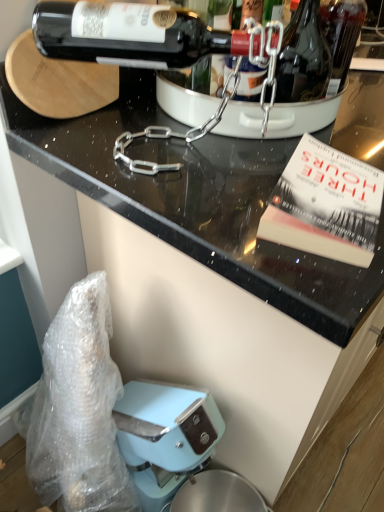
At what (x,y) coordinates should I click in order to perform the action: click on black glossy countertop at upper center. Please return your answer as a coordinate pair (x, y). Image resolution: width=384 pixels, height=512 pixels. Looking at the image, I should click on (199, 202).

From a real-world perspective, which is physically above, hardcover book at upper right or black glossy countertop at upper center?

hardcover book at upper right.

Is hardcover book at upper right bigger than black glossy countertop at upper center?

No, hardcover book at upper right is not bigger than black glossy countertop at upper center.

From the image's perspective, which one is positioned higher, hardcover book at upper right or black glossy countertop at upper center?

black glossy countertop at upper center, from the image's perspective.

Can you tell me how much hardcover book at upper right and black glossy countertop at upper center differ in facing direction?

The angle between the facing direction of hardcover book at upper right and the facing direction of black glossy countertop at upper center is 18.7 degrees.

Does black glossy countertop at upper center appear on the right side of hardcover book at upper right?

Correct, you'll find black glossy countertop at upper center to the right of hardcover book at upper right.

Looking at their sizes, would you say black glossy countertop at upper center is wider or thinner than hardcover book at upper right?

black glossy countertop at upper center is wider than hardcover book at upper right.

How different are the orientations of black glossy countertop at upper center and hardcover book at upper right in degrees?

The angular difference between black glossy countertop at upper center and hardcover book at upper right is 18.7 degrees.

Is shiny dark glass bottle at upper center located within hardcover book at upper right?

That's incorrect, shiny dark glass bottle at upper center is not inside hardcover book at upper right.

Would you say hardcover book at upper right is a long distance from shiny dark glass bottle at upper center?

They are positioned close to each other.

Where is `paperback book that is on the right side of shiny dark glass bottle at upper center`? The image size is (384, 512). paperback book that is on the right side of shiny dark glass bottle at upper center is located at coordinates (325, 205).

From the picture: From their relative heights in the image, would you say hardcover book at upper right is taller or shorter than shiny dark glass bottle at upper center?

In the image, hardcover book at upper right appears to be shorter than shiny dark glass bottle at upper center.

Based on their sizes in the image, would you say shiny dark glass bottle at upper right is bigger or smaller than hardcover book at upper right?

In the image, shiny dark glass bottle at upper right appears to be larger than hardcover book at upper right.

Is shiny dark glass bottle at upper right looking in the opposite direction of hardcover book at upper right?

No.

Is point (289, 52) closer or farther from the camera than point (325, 253)?

Point (289, 52) is positioned farther from the camera compared to point (325, 253).

Does shiny dark glass bottle at upper right lie in front of hardcover book at upper right?

No, shiny dark glass bottle at upper right is further to the viewer.

Is shiny dark glass bottle at upper center positioned far away from black glossy countertop at upper center?

shiny dark glass bottle at upper center is near black glossy countertop at upper center, not far away.

Which object is further away from the camera taking this photo, shiny dark glass bottle at upper center or black glossy countertop at upper center?

shiny dark glass bottle at upper center is further away from the camera.

Who is bigger, shiny dark glass bottle at upper center or black glossy countertop at upper center?

With larger size is black glossy countertop at upper center.

Is shiny dark glass bottle at upper center wider or thinner than black glossy countertop at upper center?

shiny dark glass bottle at upper center is thinner than black glossy countertop at upper center.

Looking at this image, are hardcover book at upper right and shiny dark glass bottle at upper right far apart?

No, there isn't a large distance between hardcover book at upper right and shiny dark glass bottle at upper right.

What's the angular difference between hardcover book at upper right and shiny dark glass bottle at upper right's facing directions?

20 degrees separate the facing orientations of hardcover book at upper right and shiny dark glass bottle at upper right.

How much distance is there between hardcover book at upper right and shiny dark glass bottle at upper right?

hardcover book at upper right is 7.21 inches away from shiny dark glass bottle at upper right.

Is hardcover book at upper right looking in the opposite direction of shiny dark glass bottle at upper right?

No, hardcover book at upper right is not facing away from shiny dark glass bottle at upper right.

From the image's perspective, which object appears higher, black glossy countertop at upper center or shiny dark glass bottle at upper center?

shiny dark glass bottle at upper center.

Which object is positioned more to the right, black glossy countertop at upper center or shiny dark glass bottle at upper center?

black glossy countertop at upper center.

Find the location of a particular element. The image size is (384, 512). wine that appears above the black glossy countertop at upper center (from a real-world perspective) is located at coordinates (208, 75).

Could you measure the distance between black glossy countertop at upper center and shiny dark glass bottle at upper center?

22.89 centimeters.

At what (x,y) coordinates should I click in order to perform the action: click on paperback book below the black glossy countertop at upper center (from the image's perspective). Please return your answer as a coordinate pair (x, y). The image size is (384, 512). Looking at the image, I should click on (325, 205).

In order to click on countertop that appears in front of the hardcover book at upper right in this screenshot , I will do `click(199, 202)`.

When comparing their distances from black glossy countertop at upper center, does hardcover book at upper right or shiny dark glass bottle at upper right seem closer?

hardcover book at upper right is positioned closer to the anchor black glossy countertop at upper center.

Based on their spatial positions, is shiny dark glass bottle at upper right or hardcover book at upper right closer to shiny dark glass bottle at upper center?

shiny dark glass bottle at upper right is positioned closer to the anchor shiny dark glass bottle at upper center.

From the image, which object appears to be nearer to black glossy countertop at upper center, shiny dark glass bottle at upper center or hardcover book at upper right?

Based on the image, hardcover book at upper right appears to be nearer to black glossy countertop at upper center.

Which object lies nearer to the anchor point shiny dark glass bottle at upper right, shiny dark glass bottle at upper center or hardcover book at upper right?

shiny dark glass bottle at upper center is closer to shiny dark glass bottle at upper right.

From the image, which object appears to be farther from hardcover book at upper right, black glossy countertop at upper center or shiny dark glass bottle at upper center?

shiny dark glass bottle at upper center is further to hardcover book at upper right.

Looking at the image, which one is located further to hardcover book at upper right, shiny dark glass bottle at upper right or black glossy countertop at upper center?

Among the two, shiny dark glass bottle at upper right is located further to hardcover book at upper right.

Looking at the image, which one is located further to shiny dark glass bottle at upper center, black glossy countertop at upper center or hardcover book at upper right?

hardcover book at upper right lies further to shiny dark glass bottle at upper center than the other object.

Which object lies nearer to the anchor point shiny dark glass bottle at upper right, black glossy countertop at upper center or shiny dark glass bottle at upper center?

shiny dark glass bottle at upper center is closer to shiny dark glass bottle at upper right.

Find the location of `paperback book between shiny dark glass bottle at upper center and black glossy countertop at upper center in the horizontal direction`. paperback book between shiny dark glass bottle at upper center and black glossy countertop at upper center in the horizontal direction is located at coordinates [325, 205].

I want to click on bottle between shiny dark glass bottle at upper center and hardcover book at upper right in the vertical direction, so click(303, 57).

Where is `bottle located between hardcover book at upper right and black glossy countertop at upper center in the left-right direction`? Image resolution: width=384 pixels, height=512 pixels. bottle located between hardcover book at upper right and black glossy countertop at upper center in the left-right direction is located at coordinates (303, 57).

Image resolution: width=384 pixels, height=512 pixels. I want to click on bottle between shiny dark glass bottle at upper center and black glossy countertop at upper center, so point(303,57).